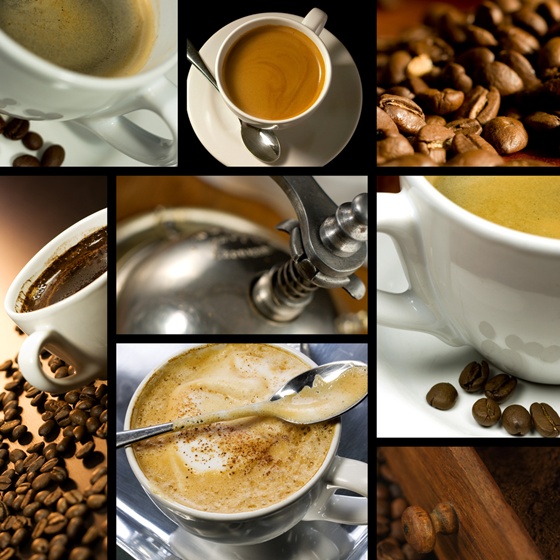
Identify the location of cups of coffee. The width and height of the screenshot is (560, 560). (105, 25), (276, 60), (515, 209), (219, 381).